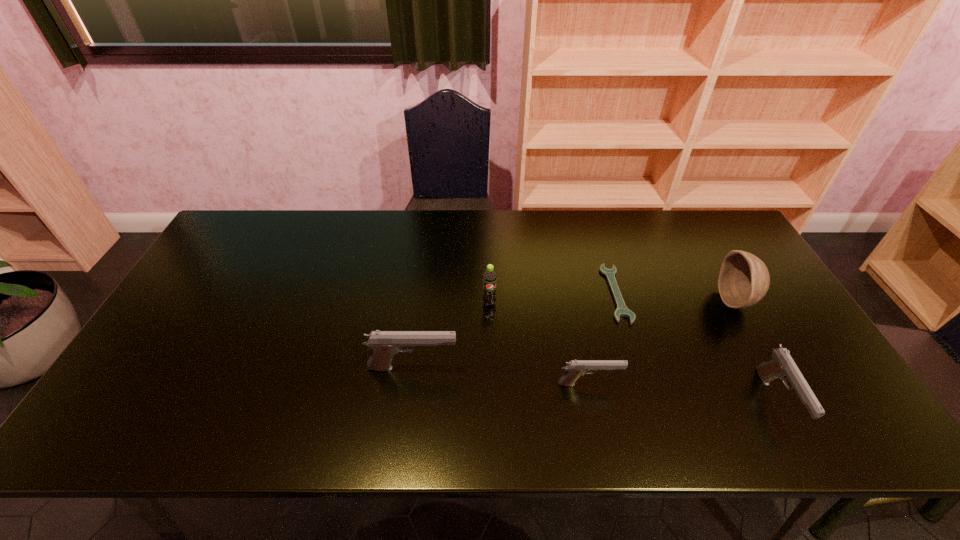
Locate an element on the screen. vacant space located 0.400m at the barrel of the tallest pistol is located at coordinates (617, 368).

At what (x,y) coordinates should I click in order to perform the action: click on vacant space located 0.390m at the barrel of the shortest pistol. Please return your answer as a coordinate pair (x, y). Looking at the image, I should click on (780, 384).

The image size is (960, 540). What are the coordinates of `vacant space located on the front of the bowl` in the screenshot? It's located at (770, 361).

Identify the location of vacant space positioned 0.300m on the front label of the soda. The width and height of the screenshot is (960, 540). (492, 403).

Locate an element on the screen. This screenshot has width=960, height=540. free region located on the left of the shortest object is located at coordinates (476, 294).

Where is `pistol positioned at the right edge`? The width and height of the screenshot is (960, 540). pistol positioned at the right edge is located at coordinates (782, 366).

The width and height of the screenshot is (960, 540). Find the location of `bowl that is at the right edge`. bowl that is at the right edge is located at coordinates [744, 279].

The width and height of the screenshot is (960, 540). I want to click on object located at the near right corner, so click(782, 366).

Locate an element on the screen. Image resolution: width=960 pixels, height=540 pixels. free spot at the far edge of the desktop is located at coordinates (320, 213).

Where is `vacant space at the right edge of the desktop`? vacant space at the right edge of the desktop is located at coordinates (736, 325).